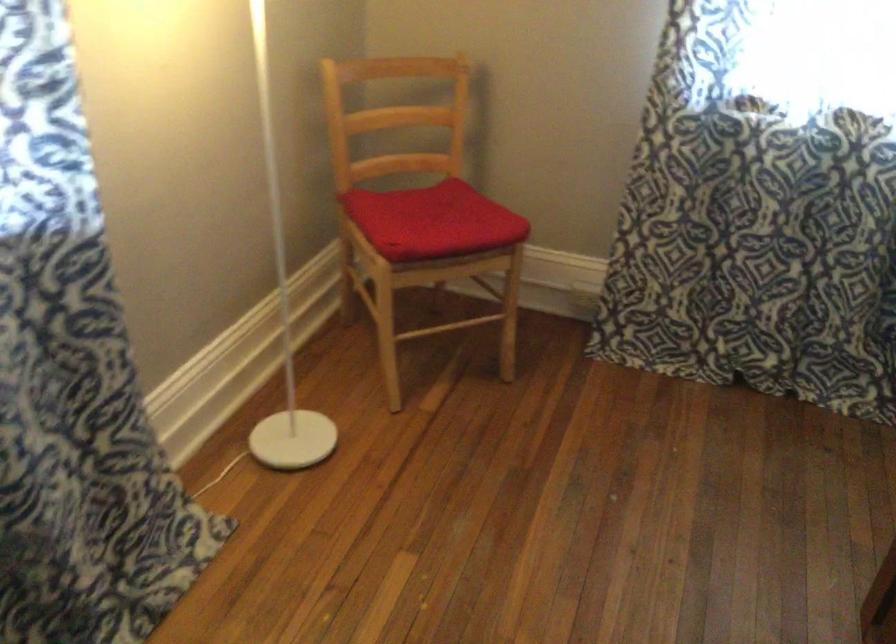
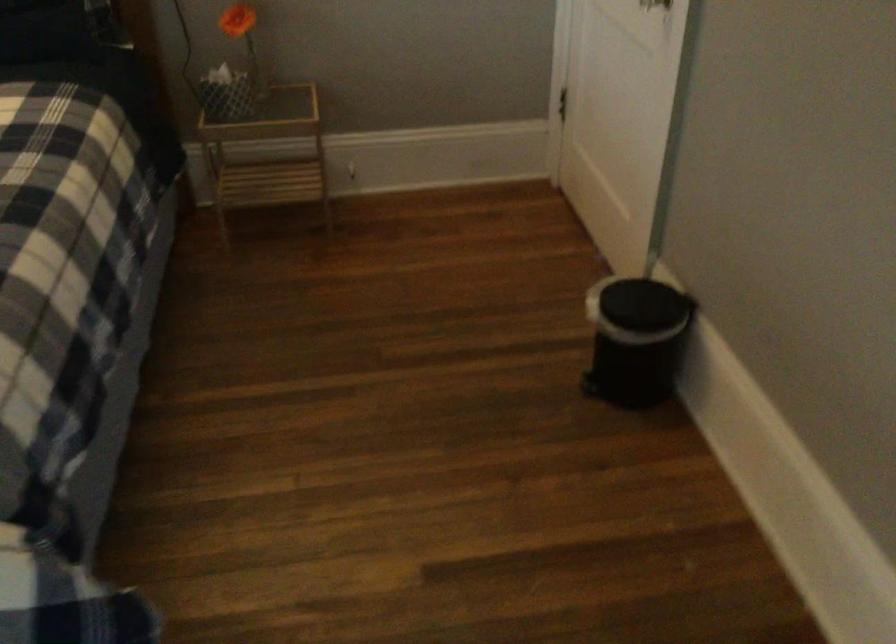
First-person continuous shooting, in which direction is the camera rotating?

The rotation direction of the camera is right-down.